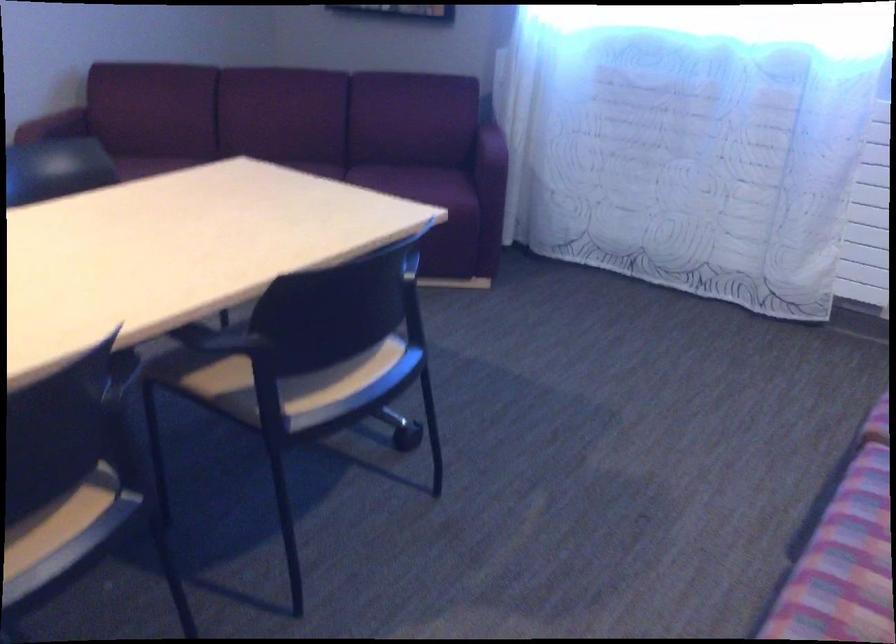
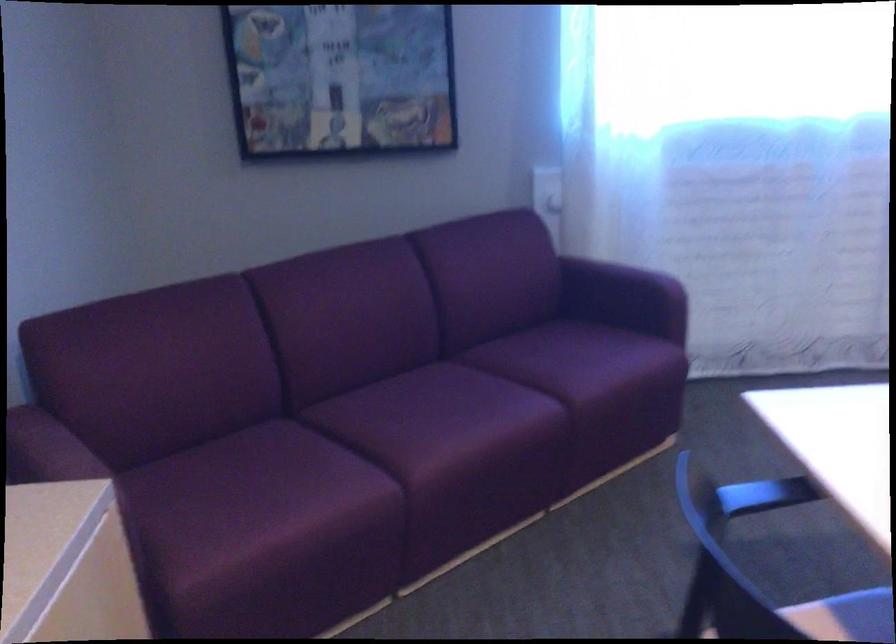
Where in the second image is the point corresponding to the point at 466,144 from the first image?

(617, 289)